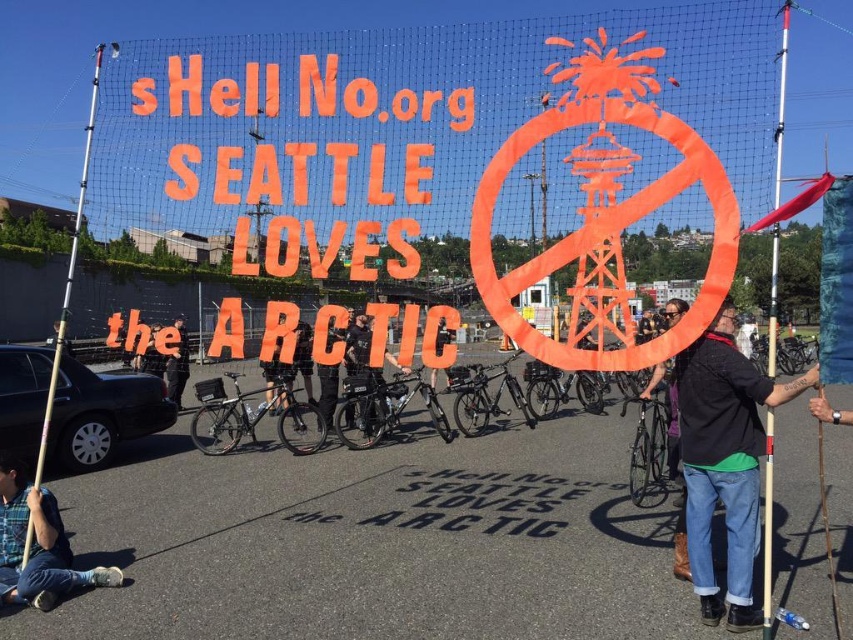
Question: Where is black fabric pants at center located in relation to dark blue jeans at center in the image?

Choices:
 (A) left
 (B) right

Answer: (B)

Question: Which point is closer to the camera taking this photo?

Choices:
 (A) [347, 332]
 (B) [53, 582]
 (C) [775, 248]
 (D) [167, 385]

Answer: (C)

Question: In this image, where is black fabric shirt at center located relative to dark blue jeans at center?

Choices:
 (A) left
 (B) right

Answer: (B)

Question: Can you confirm if black fabric shirt at center is bigger than wooden pole at right?

Choices:
 (A) no
 (B) yes

Answer: (A)

Question: Which object appears closest to the camera in this image?

Choices:
 (A) black fabric pants at center
 (B) black fabric shirt at center
 (C) dark blue jeans at center
 (D) wooden pole at right

Answer: (D)

Question: Estimate the real-world distances between objects in this image. Which object is farther from the silver metallic pole at left?

Choices:
 (A) black fabric pants at center
 (B) black fabric shirt at center
 (C) wooden pole at right

Answer: (C)